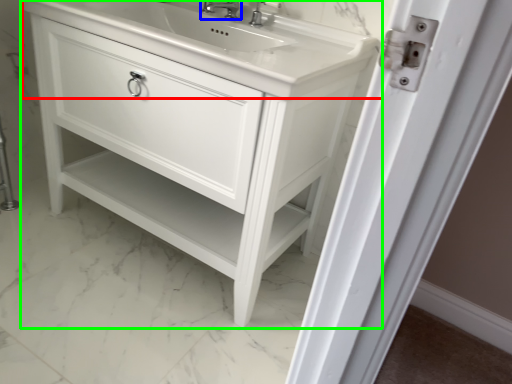
Question: Which object is positioned farthest from counter top (highlighted by a red box)? Select from tap (highlighted by a blue box) and bathroom cabinet (highlighted by a green box).

Choices:
 (A) tap
 (B) bathroom cabinet

Answer: (A)